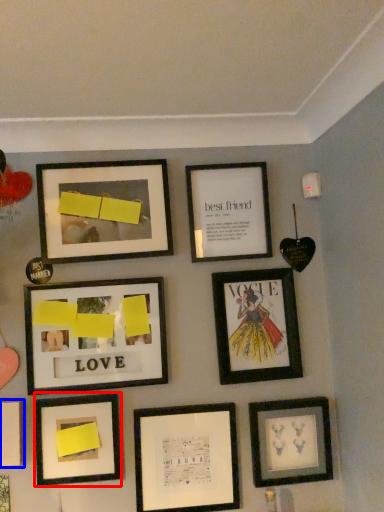
Question: Which object is further to the camera taking this photo, picture frame (highlighted by a red box) or picture frame (highlighted by a blue box)?

Choices:
 (A) picture frame
 (B) picture frame

Answer: (A)